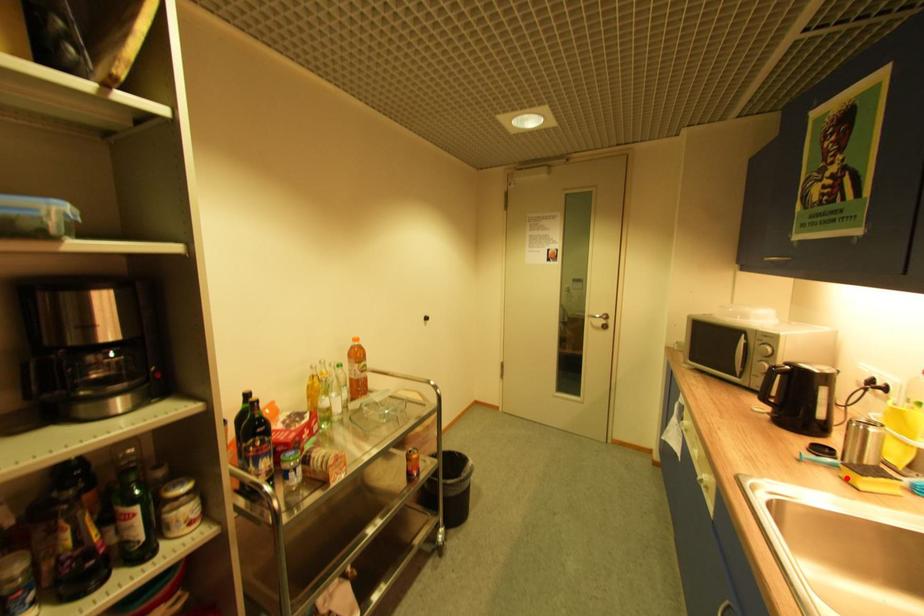
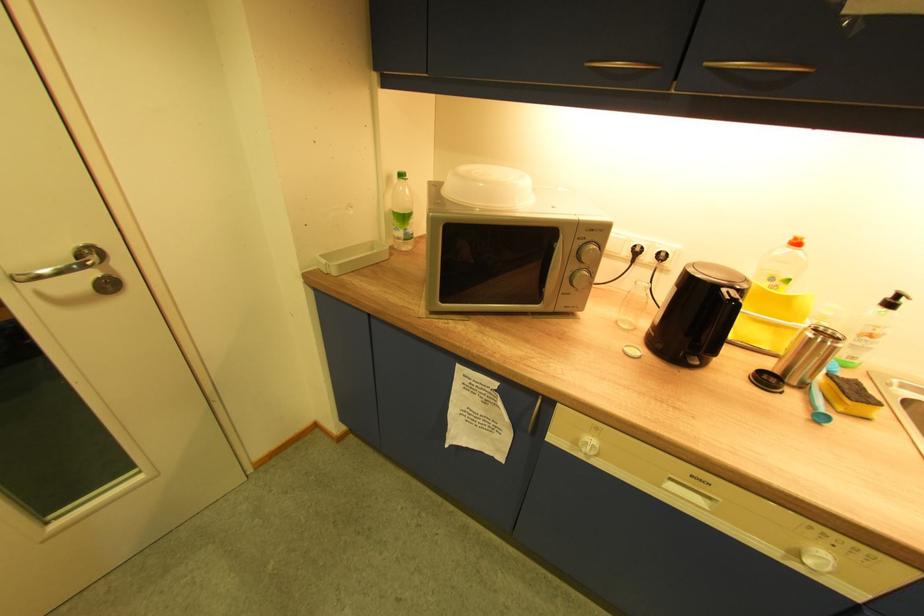
Where in the second image is the point corresponding to the highlighted location from the first image?

(843, 413)